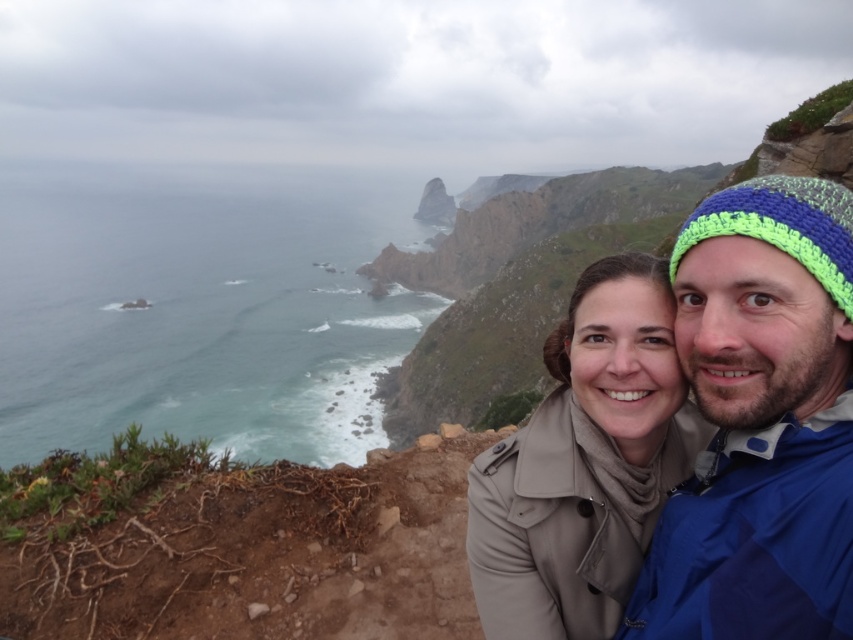
Question: Is blue knitted beanie at right thinner than beige fabric coat at center?

Choices:
 (A) yes
 (B) no

Answer: (A)

Question: Among these points, which one is nearest to the camera?

Choices:
 (A) tap(793, 212)
 (B) tap(674, 454)

Answer: (A)

Question: Is blue knitted beanie at right bigger than beige fabric coat at center?

Choices:
 (A) yes
 (B) no

Answer: (B)

Question: Which point appears farthest from the camera in this image?

Choices:
 (A) (656, 424)
 (B) (798, 452)

Answer: (A)

Question: Is blue knitted beanie at right to the right of beige fabric coat at center from the viewer's perspective?

Choices:
 (A) no
 (B) yes

Answer: (B)